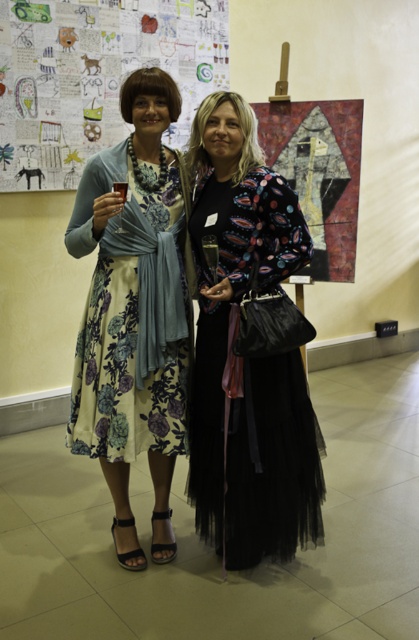
In the scene shown: You are an event planner setting up a photo booth area in the gallery. The photo booth requires a 2 meter clear space between the black tulle dress at center and the colored paper collage at upper left. Is the current distance sufficient?

The black tulle dress at center is 1.65 meters from the colored paper collage at upper left. Since the required distance is 2 meters, the current space is insufficient for the photo booth setup.

You are an artist planning to place a new sculpture between the colored paper collage at upper left and the floral silk dress at center. Based on their positions, which object should the sculpture be closer to?

The sculpture should be placed closer to the colored paper collage at upper left since it is positioned to the left of the floral silk dress at center, meaning the distance between them places the sculpture nearer to the collage.